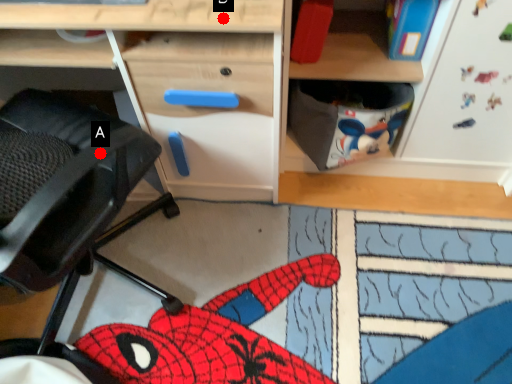
Question: Two points are circled on the image, labeled by A and B beside each circle. Which point is closer to the camera taking this photo?

Choices:
 (A) A is closer
 (B) B is closer

Answer: (A)